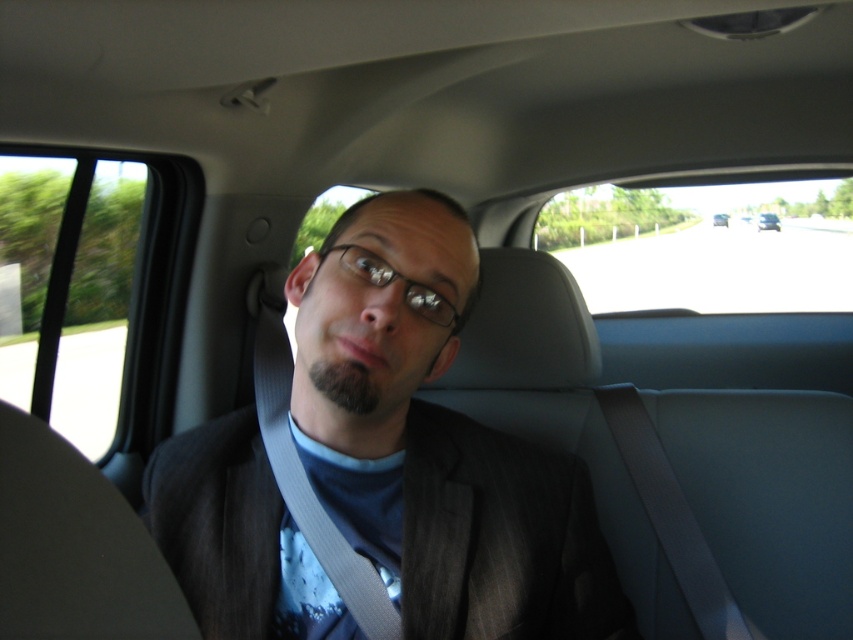
I want to click on dark gray suit at center, so click(x=434, y=442).

Identify the location of dark gray suit at center. (434, 442).

In the scene shown: Which is more to the right, black plastic glasses at center or metallic silver car at center?

Positioned to the right is metallic silver car at center.

Does black plastic glasses at center have a greater width compared to metallic silver car at center?

Yes.

The image size is (853, 640). In order to click on black plastic glasses at center in this screenshot , I will do `click(395, 278)`.

Where is `dark gray suit at center`? This screenshot has width=853, height=640. dark gray suit at center is located at coordinates (434, 442).

Is point (271, 636) farther from viewer compared to point (368, 273)?

Yes, it is behind point (368, 273).

The width and height of the screenshot is (853, 640). Identify the location of dark gray suit at center. (434, 442).